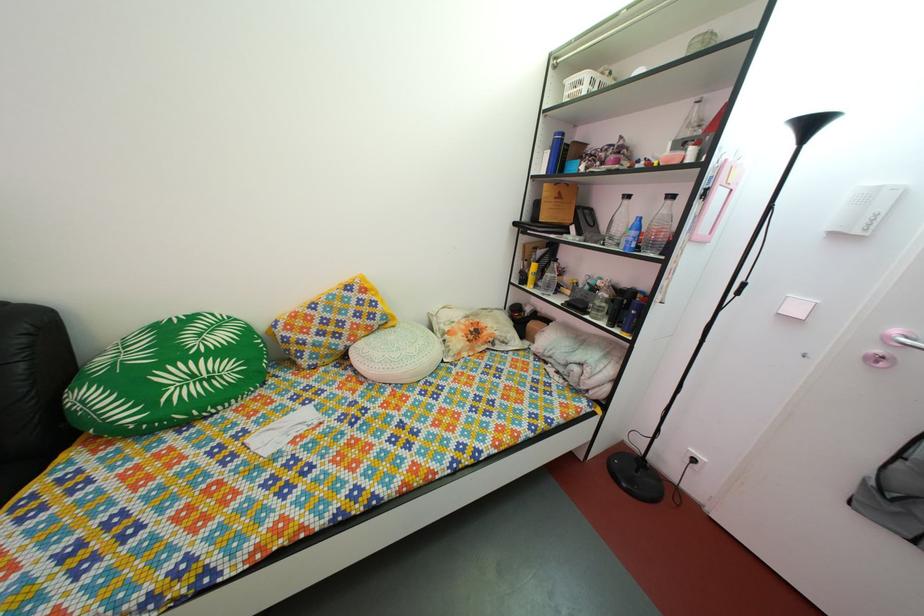
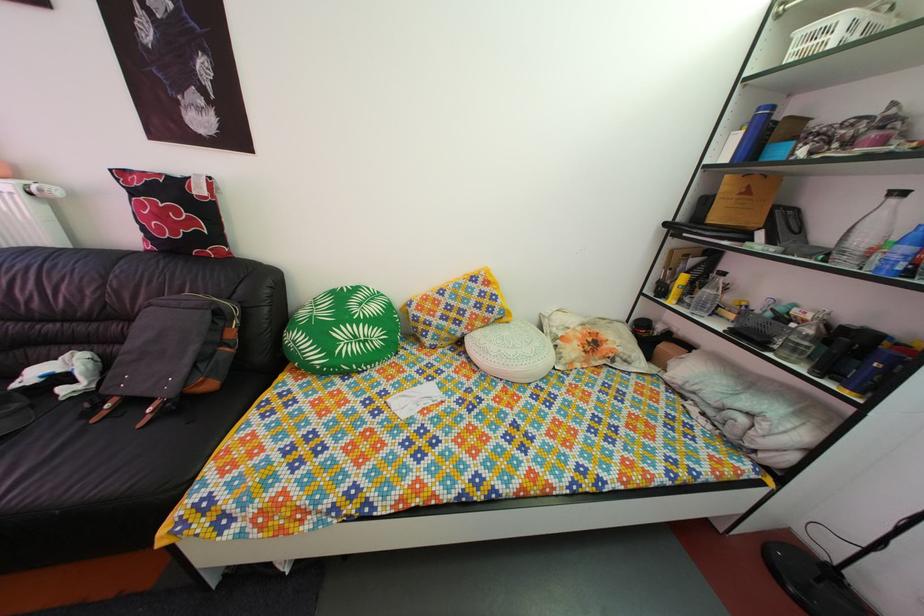
Question: How did the camera likely rotate?

Choices:
 (A) Left
 (B) Right
 (C) Up
 (D) Down

Answer: (A)